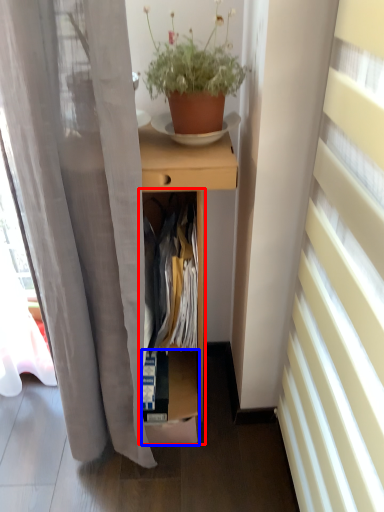
Question: Among these objects, which one is farthest to the camera, cabinet (highlighted by a red box) or shelf (highlighted by a blue box)?

Choices:
 (A) cabinet
 (B) shelf

Answer: (B)